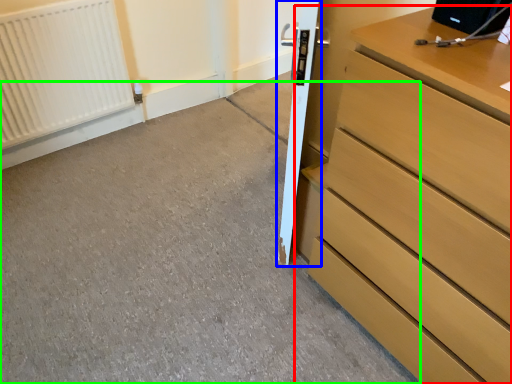
Question: Estimate the real-world distances between objects in this image. Which object is closer to chest of drawers (highlighted by a red box), door (highlighted by a blue box) or concrete (highlighted by a green box)?

Choices:
 (A) door
 (B) concrete

Answer: (A)